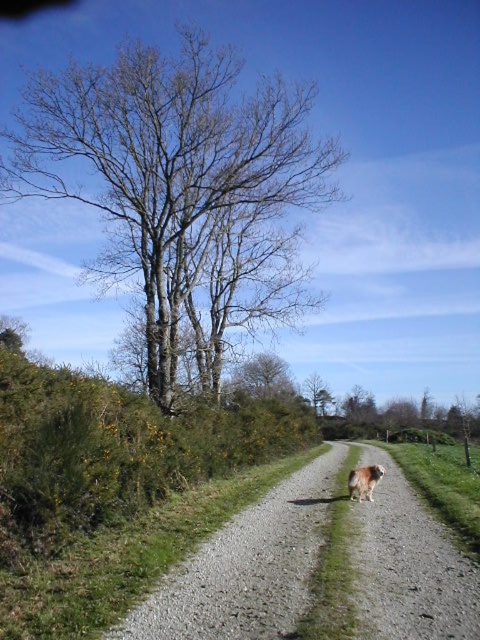
You are standing at the point with coordinates 0.887, 0.515. Can you see the gravelly dirt road at center from your current position?

Yes, because the gravelly dirt road at center is located at point (x=247, y=566), so you are exactly at the road.

You are a hiker standing on the gravelly dirt road at center and want to take a photo of the brown leafless tree at upper center. Which direction should you face to capture the tree in your shot?

To capture the brown leafless tree at upper center, you should face to the right side since the gravelly dirt road at center is positioned on the left side of the brown leafless tree at upper center.

You are standing at the point marked by the coordinates point (167, 170) in the image. Looking around, you see the gravel path meandering through the landscape with dense vegetation on the left and grassy areas on the right. Which direction should you walk to stay on the gravel path?

The point (167, 170) marks the bare wood tree at upper left. To stay on the gravel path, you should walk away from the dense vegetation on the left side and towards the grassy areas on the right side.